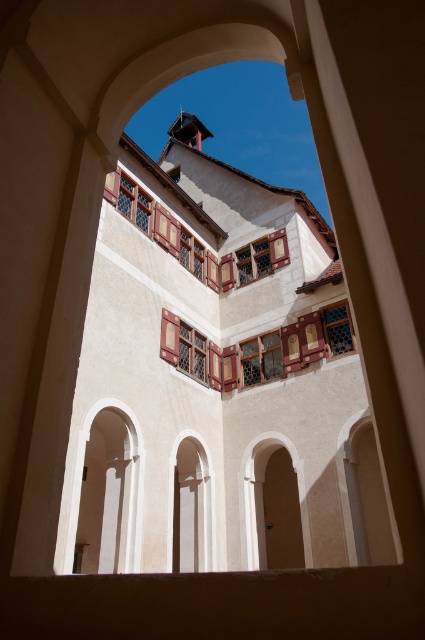
Based on the photo, can you confirm if matte glass window at upper right is thinner than wooden stained glass window at upper center?

In fact, matte glass window at upper right might be wider than wooden stained glass window at upper center.

Is matte glass window at upper right above wooden stained glass window at upper center?

No, matte glass window at upper right is not above wooden stained glass window at upper center.

Describe the element at coordinates (337, 328) in the screenshot. I see `matte glass window at upper right` at that location.

I want to click on matte glass window at upper right, so click(337, 328).

Does matte glass window at center appear over wooden lattice window at center?

Yes, matte glass window at center is above wooden lattice window at center.

Is point (212, 346) closer to viewer compared to point (269, 332)?

That is False.

Locate an element on the screen. The height and width of the screenshot is (640, 425). matte glass window at center is located at coordinates (189, 349).

Measure the distance from white smooth archway at left to wooden lattice window at center.

They are 9.16 meters apart.

Does white smooth archway at left appear over wooden lattice window at center?

Actually, white smooth archway at left is below wooden lattice window at center.

Is point (124, 518) positioned behind point (275, 376)?

No, (124, 518) is closer to viewer.

This screenshot has width=425, height=640. In order to click on white smooth archway at left in this screenshot , I will do `click(105, 490)`.